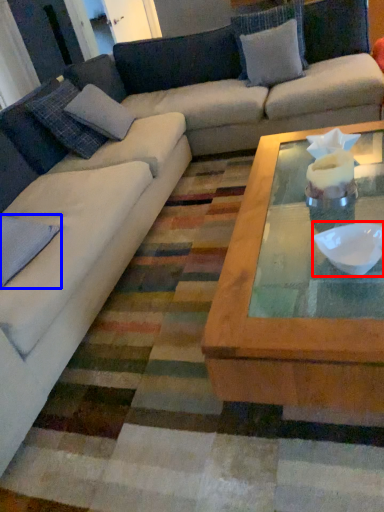
Question: Which point is closer to the camera, bowl (highlighted by a red box) or pillow (highlighted by a blue box)?

Choices:
 (A) bowl
 (B) pillow

Answer: (A)